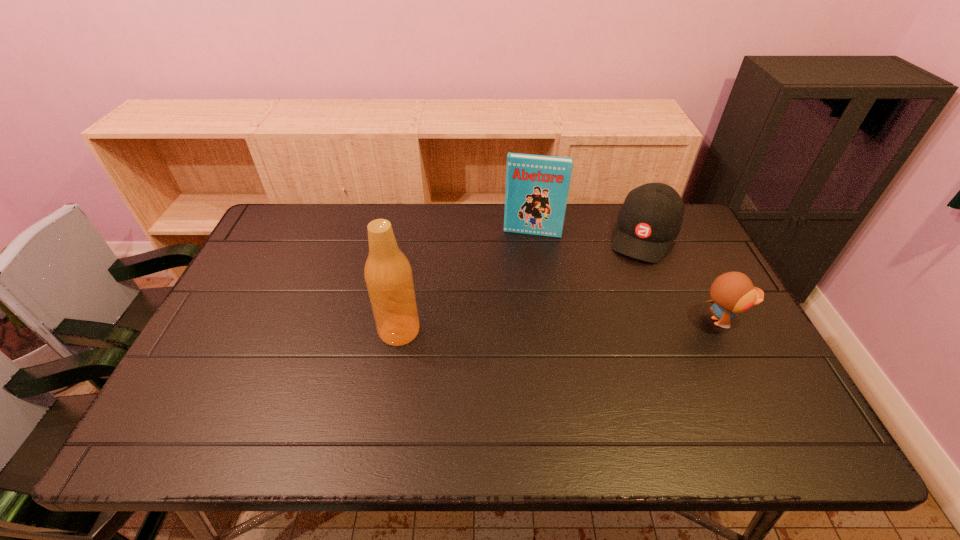
Where is `free space located 0.070m with a logo on the front of the baseball cap`? free space located 0.070m with a logo on the front of the baseball cap is located at coordinates (631, 274).

Locate an element on the screen. This screenshot has width=960, height=540. free region located 0.250m with a logo on the front of the baseball cap is located at coordinates (612, 314).

Locate an element on the screen. Image resolution: width=960 pixels, height=540 pixels. free space located with a logo on the front of the baseball cap is located at coordinates (605, 332).

I want to click on book that is at the far edge, so click(x=537, y=186).

The width and height of the screenshot is (960, 540). I want to click on baseball cap located in the far edge section of the desktop, so click(x=650, y=219).

The image size is (960, 540). I want to click on duck at the right edge, so [x=733, y=292].

The height and width of the screenshot is (540, 960). Identify the location of baseball cap that is positioned at the right edge. (650, 219).

I want to click on object that is at the far right corner, so click(650, 219).

In the image, there is a desktop. What are the coordinates of `blank space at the far edge` in the screenshot? It's located at (422, 210).

This screenshot has width=960, height=540. I want to click on free space at the left edge, so click(245, 338).